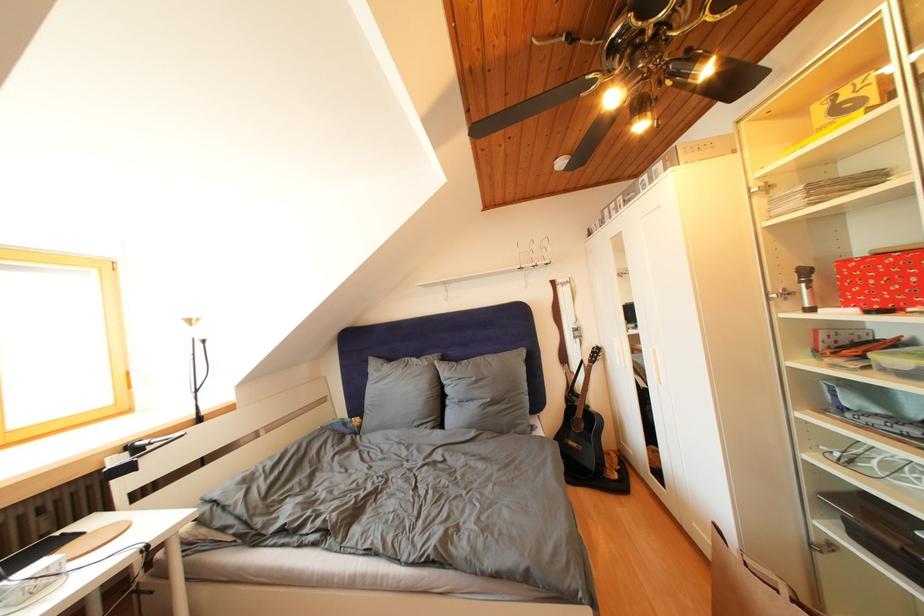
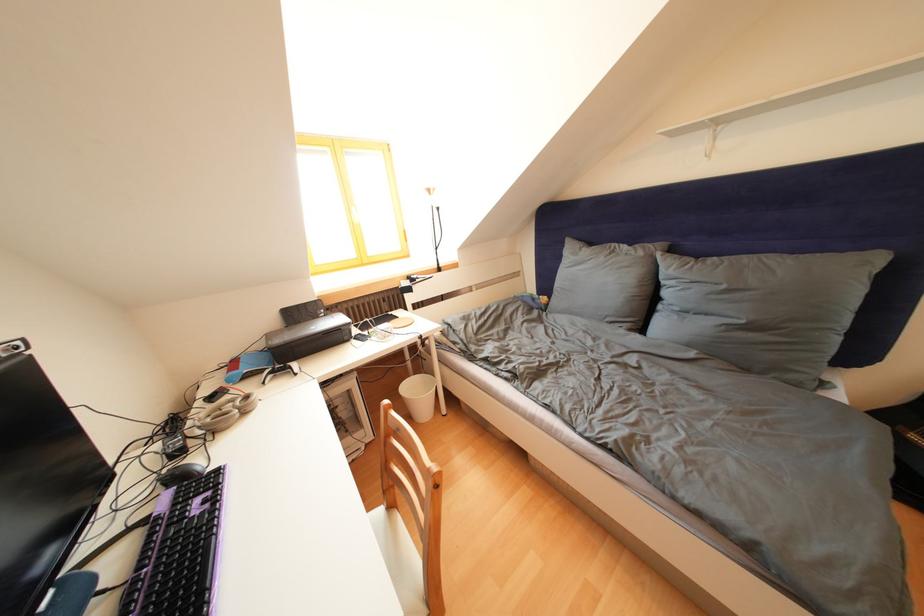
Locate, in the second image, the point that corresponds to the point at 482,384 in the first image.

(733, 292)